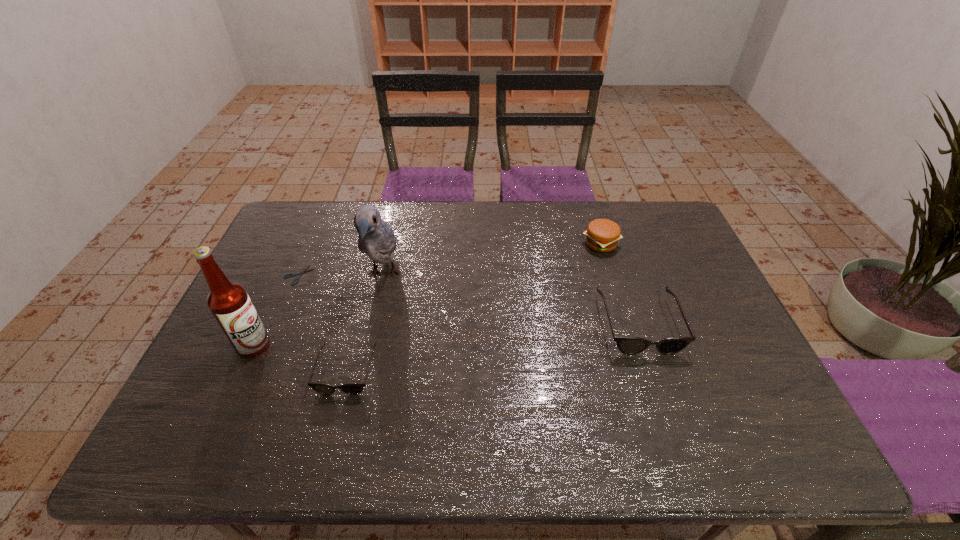
The height and width of the screenshot is (540, 960). I want to click on free space between the shears and the right sunglasses, so click(468, 299).

Locate an element on the screen. vacant area that lies between the shears and the alcohol is located at coordinates (276, 310).

Where is `free space between the right sunglasses and the hamburger`? free space between the right sunglasses and the hamburger is located at coordinates (619, 284).

Select which object appears as the fourth closest to the alcohol. Please provide its 2D coordinates. Your answer should be formatted as a tuple, i.e. [(x, y)], where the tuple contains the x and y coordinates of a point satisfying the conditions above.

[(628, 345)]

Locate which object is the closest to the alcohol. Please provide its 2D coordinates. Your answer should be formatted as a tuple, i.e. [(x, y)], where the tuple contains the x and y coordinates of a point satisfying the conditions above.

[(351, 388)]

Identify the location of blank area in the image that satisfies the following two spatial constraints: 1. on the front lenses of the right sunglasses; 2. on the label side of the alcohol. The height and width of the screenshot is (540, 960). (646, 345).

At what (x,y) coordinates should I click in order to perform the action: click on vacant region that satisfies the following two spatial constraints: 1. on the front-facing side of the second tallest object; 2. on the label side of the alcohol. Please return your answer as a coordinate pair (x, y). This screenshot has width=960, height=540. Looking at the image, I should click on (368, 345).